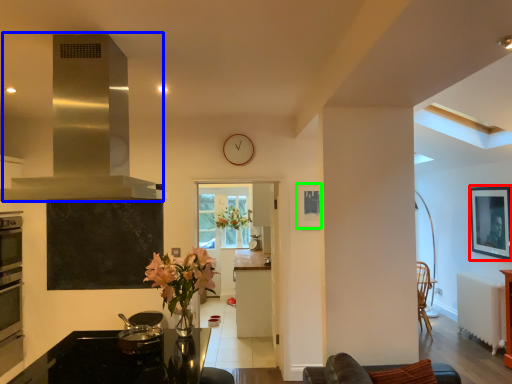
Question: Which is farther away from picture frame (highlighted by a red box)? exhaust hood (highlighted by a blue box) or picture frame (highlighted by a green box)?

Choices:
 (A) exhaust hood
 (B) picture frame

Answer: (A)